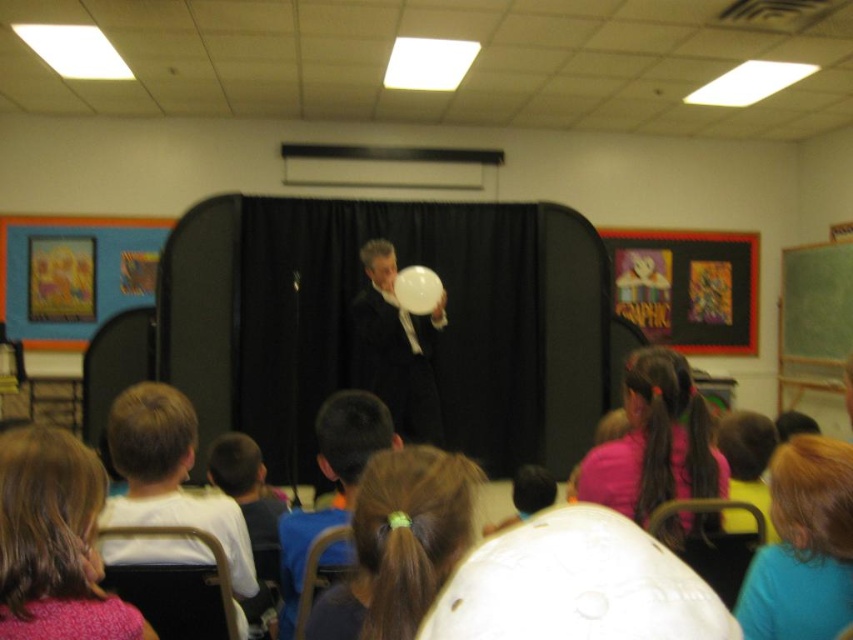
Question: Which of the following is the farthest from the observer?

Choices:
 (A) blue fabric shirt at lower right
 (B) white glossy balloon at center
 (C) matte black suit at center
 (D) pink fabric ponytail at center

Answer: (B)

Question: Does blonde hair at lower left appear under white glossy balloon at center?

Choices:
 (A) no
 (B) yes

Answer: (B)

Question: Can you confirm if blonde hair at lower left is wider than matte black suit at center?

Choices:
 (A) yes
 (B) no

Answer: (B)

Question: Is brown hair at center wider than blue fabric shirt at lower right?

Choices:
 (A) no
 (B) yes

Answer: (B)

Question: Which of the following is the closest to the observer?

Choices:
 (A) (393, 413)
 (B) (317, 428)
 (C) (343, 598)

Answer: (C)

Question: Which point is closer to the camera taking this photo?

Choices:
 (A) (305, 513)
 (B) (401, 435)

Answer: (A)